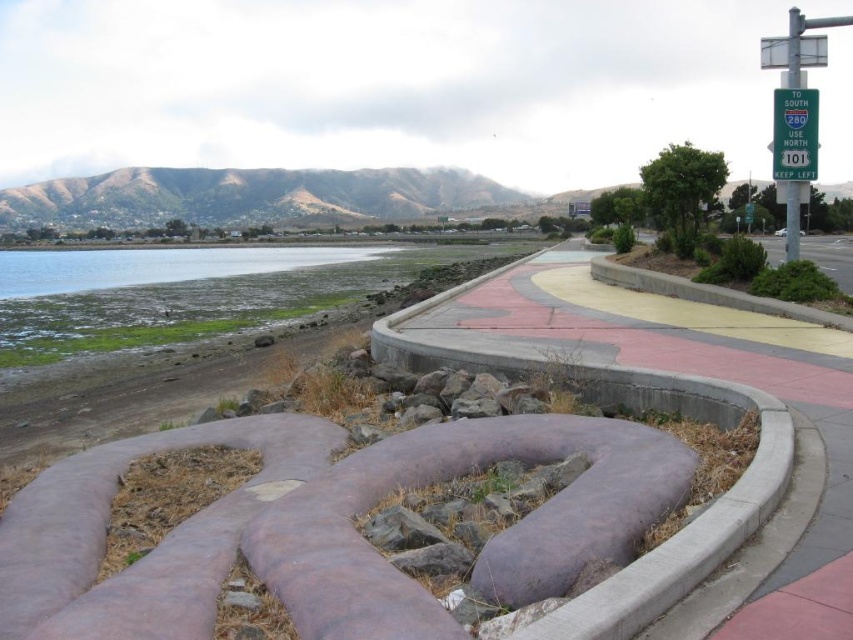
You are a hiker who wants to reach the water from the current position. The purple rubber path at center and the green plastic sign at upper right are visible. Which object should you move towards first to get to the water?

You should move towards the purple rubber path at center first because it is in front of the green plastic sign at upper right, meaning it is closer to your current position and leads directly toward the water.

You are standing at the point labeled as point (706, 376) in the image. What object are you currently standing on?

You are standing on the purple rubber path at center as indicated by the point (706, 376).